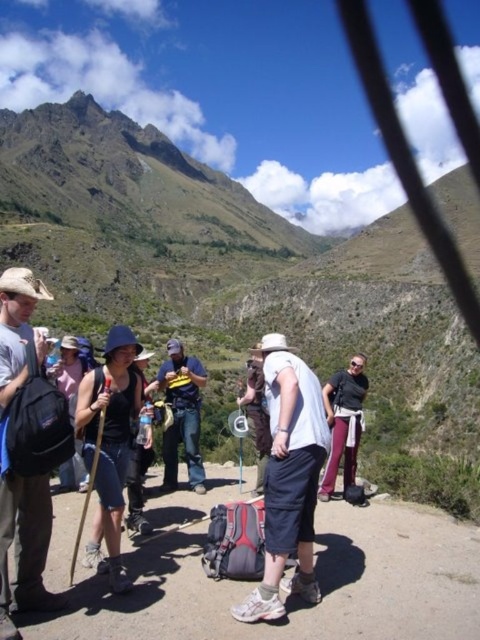
You are a hiker who needs to retrieve your matte black backpack at left and your matte black backpack at center. Based on the scene, which backpack is positioned higher up the mountain?

The matte black backpack at left is located above the matte black backpack at center, so it is positioned higher up the mountain.

You are planning to walk along the dirt path at center while carrying your matte black backpack at left. Since the path is narrow, will the backpack fit comfortably without hitting the sides?

The dirt path at center is thinner than the matte black backpack at left, so the backpack may not fit comfortably as it might be wider than the path, causing it to hit the sides.

You are standing at the edge of the mountain valley and want to find the dirt path at center. According to the coordinates provided, where should you look to locate it?

The dirt path at center is located at the 2D coordinates point of (289, 602).